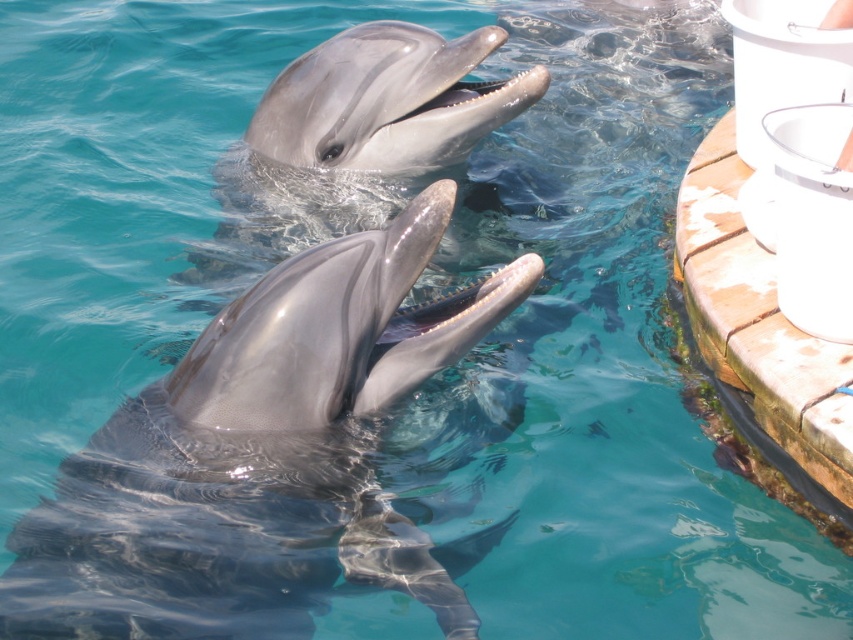
Which of these two, glossy gray dolphin at center or shiny gray dolphin at upper center, stands taller?

glossy gray dolphin at center is taller.

Locate an element on the screen. glossy gray dolphin at center is located at coordinates (260, 458).

Where is `glossy gray dolphin at center`? glossy gray dolphin at center is located at coordinates (260, 458).